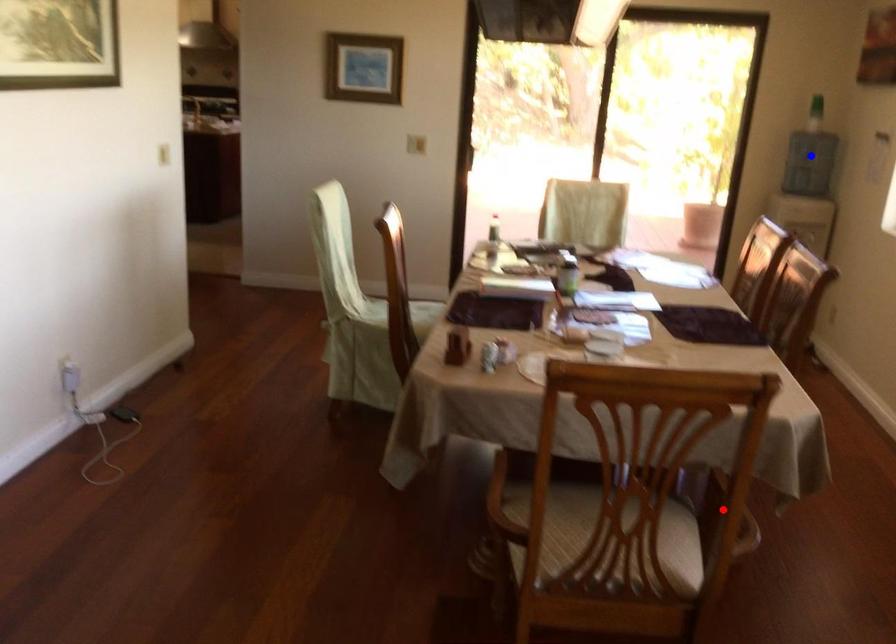
Question: Which of the two points in the image is closer to the camera?

Choices:
 (A) Blue point is closer.
 (B) Red point is closer.

Answer: (B)